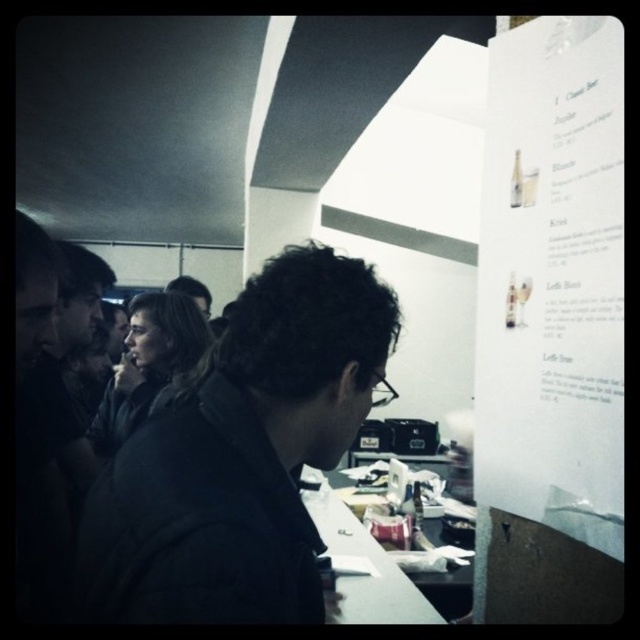
Where is the dark fabric jacket at center located in the image?

The dark fabric jacket at center is located at point (241,456) in the image.

You are a person trying to read the white paper menu at upper right while standing near the dark fabric jacket at center. Can you comfortably reach the menu without moving your body?

The distance between the dark fabric jacket at center and the white paper menu at upper right is 14.23 inches. Since this distance is within typical arm reach for most adults, you should be able to comfortably reach the white paper menu at upper right without needing to move your body.